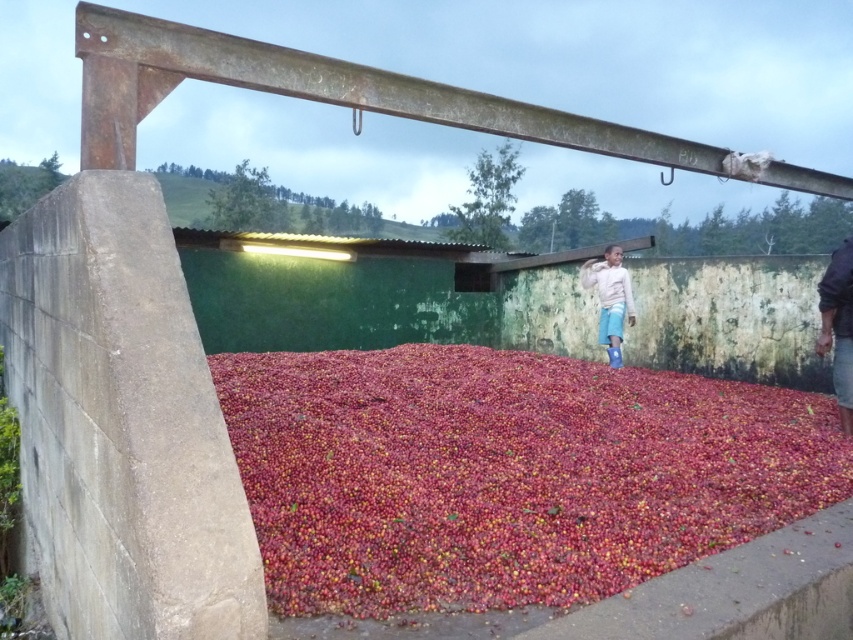
Question: Which of these objects is positioned closest to the light beige sweater at upper right?

Choices:
 (A) dark blue fabric at right
 (B) smooth red berries at center
 (C) rusty metal beam at upper center

Answer: (B)

Question: Which object appears closest to the camera in this image?

Choices:
 (A) light beige sweater at upper right
 (B) smooth red berries at center
 (C) dark blue fabric at right
 (D) rusty metal beam at upper center

Answer: (D)

Question: Can you confirm if rusty metal beam at upper center is wider than light beige sweater at upper right?

Choices:
 (A) no
 (B) yes

Answer: (A)

Question: Is smooth red berries at center to the left of rusty metal beam at upper center from the viewer's perspective?

Choices:
 (A) no
 (B) yes

Answer: (A)

Question: Can you confirm if smooth red berries at center is smaller than dark blue fabric at right?

Choices:
 (A) no
 (B) yes

Answer: (A)

Question: Which point is farther from the camera taking this photo?

Choices:
 (A) (630, 289)
 (B) (849, 378)
 (C) (103, 8)
 (D) (724, 545)

Answer: (A)